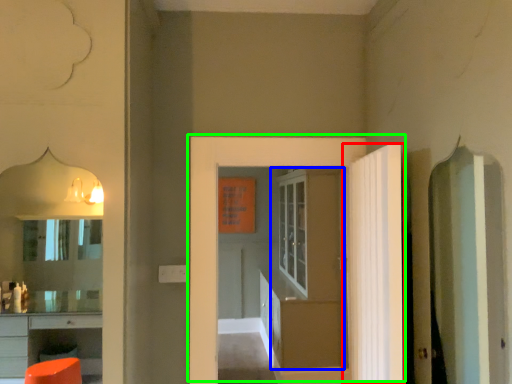
Question: Estimate the real-world distances between objects in this image. Which object is farther from door (highlighted by a red box), door (highlighted by a blue box) or door (highlighted by a green box)?

Choices:
 (A) door
 (B) door

Answer: (A)